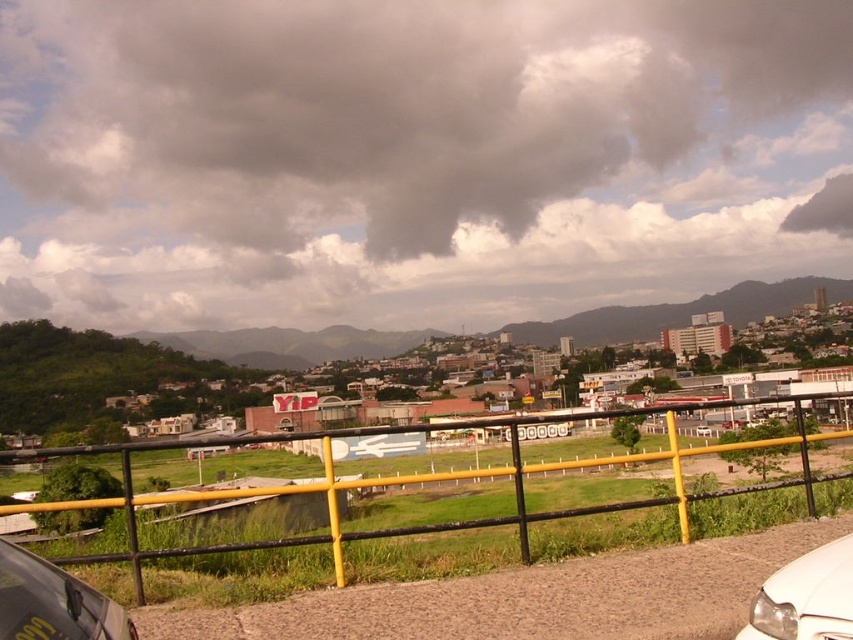
Which is below, gray fluffy cloud at upper center or metallic silver car at lower left?

Positioned lower is metallic silver car at lower left.

What do you see at coordinates (401, 113) in the screenshot?
I see `gray fluffy cloud at upper center` at bounding box center [401, 113].

Who is more forward, (213, 208) or (20, 627)?

Point (20, 627)

At what (x,y) coordinates should I click in order to perform the action: click on gray fluffy cloud at upper center. Please return your answer as a coordinate pair (x, y). This screenshot has height=640, width=853. Looking at the image, I should click on (401, 113).

Who is higher up, yellow metal fence at center or metallic silver car at lower left?

Positioned higher is metallic silver car at lower left.

Can you confirm if yellow metal fence at center is smaller than metallic silver car at lower left?

No.

Which is behind, point (86, 502) or point (3, 568)?

The point (86, 502) is more distant.

Where is `yellow metal fence at center`? The height and width of the screenshot is (640, 853). yellow metal fence at center is located at coordinates (479, 518).

Does gray fluffy cloud at upper center come in front of white glossy car at lower right?

No, it is not.

How far apart are gray fluffy cloud at upper center and white glossy car at lower right?

gray fluffy cloud at upper center and white glossy car at lower right are 364.31 feet apart.

You are a GUI agent. You are given a task and a screenshot of the screen. Output one action in this format:
    pyautogui.click(x=<x>, y=<y>)
    Task: Click on the gray fluffy cloud at upper center
    
    Given the screenshot: What is the action you would take?
    pyautogui.click(x=401, y=113)